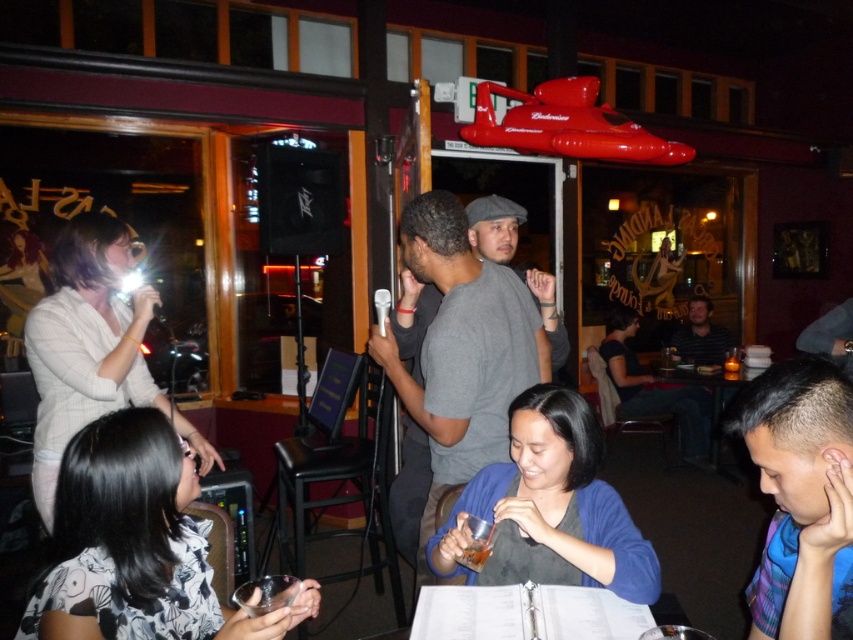
Between short hair at lower right and clear plastic cup at lower center, which one is positioned lower?

clear plastic cup at lower center

Which is in front, point (752, 400) or point (265, 592)?

Point (752, 400)

Locate an element on the screen. short hair at lower right is located at coordinates (799, 493).

Measure the distance between clear plastic cup at lower center and translucent glass cup at center.

A distance of 15.05 inches exists between clear plastic cup at lower center and translucent glass cup at center.

Which is behind, point (289, 589) or point (467, 552)?

The point (467, 552) is behind.

Locate an element on the screen. This screenshot has width=853, height=640. clear plastic cup at lower center is located at coordinates (265, 593).

Who is more forward, (680, 346) or (473, 557)?

Positioned in front is point (473, 557).

Does striped shirt at center appear on the right side of translucent plastic cup at lower center?

Correct, you'll find striped shirt at center to the right of translucent plastic cup at lower center.

Between point (709, 353) and point (474, 557), which one is positioned in front?

Point (474, 557) is in front.

Find the location of a particular element. striped shirt at center is located at coordinates (701, 337).